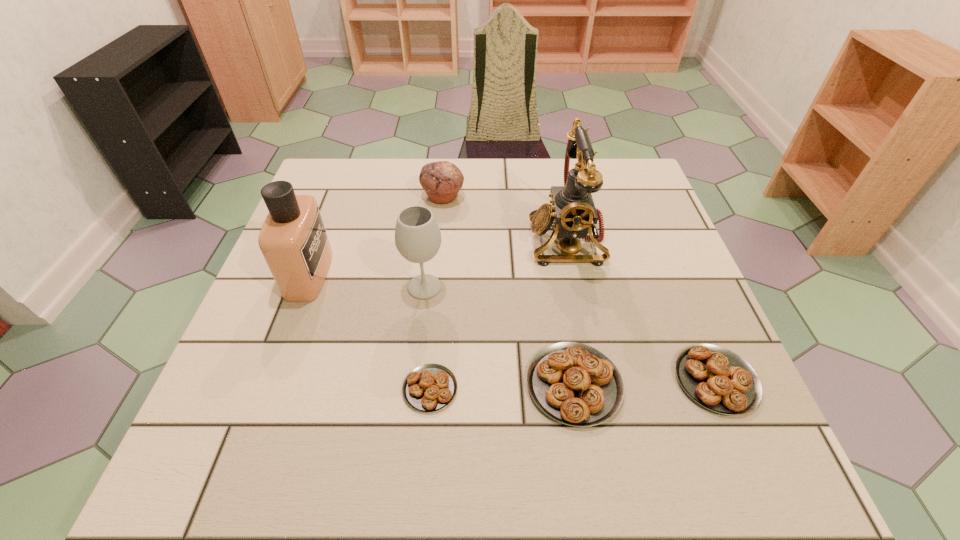
At what (x,y) coordinates should I click in order to perform the action: click on the shortest object. Please return your answer as a coordinate pair (x, y). Looking at the image, I should click on (428, 388).

Where is `the leftmost pastry`? the leftmost pastry is located at coordinates (428, 388).

Image resolution: width=960 pixels, height=540 pixels. I want to click on the second pastry from left to right, so click(575, 384).

Identify the location of the second shortest pastry. (x=718, y=379).

Find the location of a particular element. The height and width of the screenshot is (540, 960). the rightmost pastry is located at coordinates (718, 379).

Find the location of a particular element. the fourth shortest object is located at coordinates (442, 180).

Locate an element on the screen. This screenshot has height=540, width=960. muffin is located at coordinates (442, 180).

Where is `the tallest object`? The height and width of the screenshot is (540, 960). the tallest object is located at coordinates (573, 213).

Where is `the leftmost object`? The image size is (960, 540). the leftmost object is located at coordinates (293, 240).

In order to click on wineglass in this screenshot , I will do [418, 238].